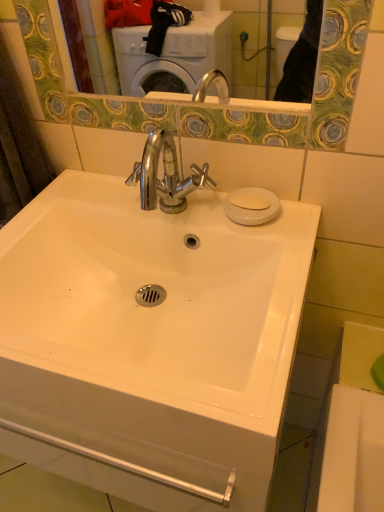
Question: Is point (248, 187) closer or farther from the camera than point (26, 287)?

Choices:
 (A) closer
 (B) farther

Answer: (B)

Question: In terms of size, does white matte soap at upper right appear bigger or smaller than white glossy sink at center?

Choices:
 (A) small
 (B) big

Answer: (A)

Question: In terms of height, does white matte soap at upper right look taller or shorter compared to white glossy sink at center?

Choices:
 (A) tall
 (B) short

Answer: (B)

Question: From the image's perspective, is white glossy sink at center located above or below white matte soap at upper right?

Choices:
 (A) below
 (B) above

Answer: (A)

Question: Is white glossy sink at center in front of or behind white matte soap at upper right in the image?

Choices:
 (A) behind
 (B) front

Answer: (B)

Question: From a real-world perspective, relative to white matte soap at upper right, is white glossy sink at center vertically above or below?

Choices:
 (A) above
 (B) below

Answer: (B)

Question: Based on their positions, is white glossy sink at center located to the left or right of white matte soap at upper right?

Choices:
 (A) left
 (B) right

Answer: (A)